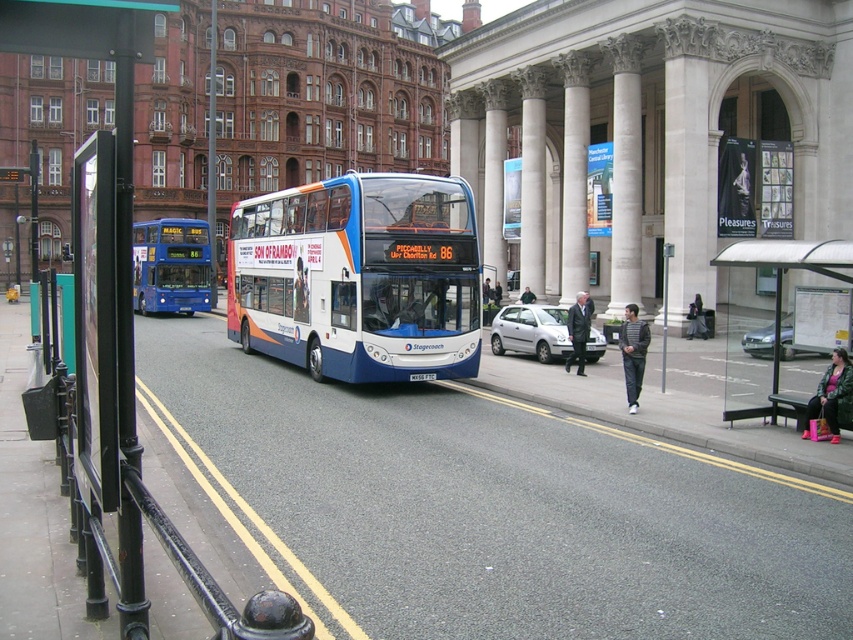
You are a pedestrian standing on the sidewalk and want to see the advertisements on the transparent glass bus stop at right and the silver metallic sedan at center. Which object is taller?

The transparent glass bus stop at right is taller than the silver metallic sedan at center.

What is located at the point with coordinates (531, 332) in the image?

A silver metallic hatchback at center is located at the point with coordinates (531, 332) in the image.

You are a pedestrian standing on the sidewalk and see the blue matte bus at center and the black plastic license plate at center. Which one is closer to your left side?

The blue matte bus at center is to the left of the black plastic license plate at center, so the blue matte bus at center is closer to your left side.